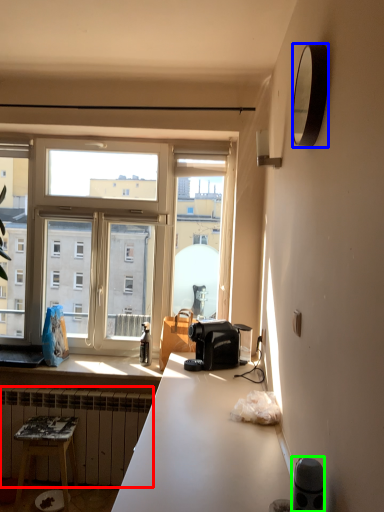
Question: Which is farther away from radiator (highlighted by a red box)? mirror (highlighted by a blue box) or appliance (highlighted by a green box)?

Choices:
 (A) mirror
 (B) appliance

Answer: (A)